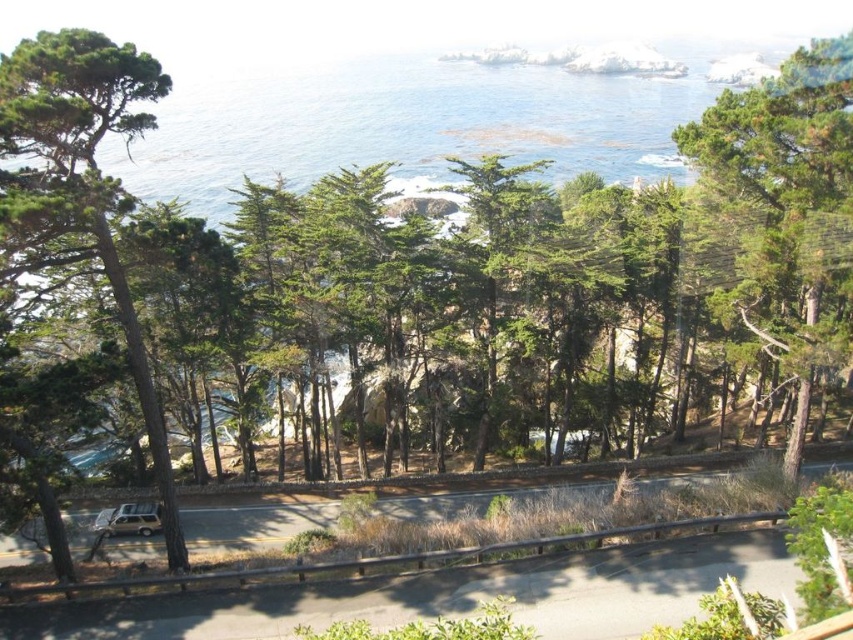
Who is more distant from viewer, (805,144) or (141,529)?

The point (141,529) is behind.

Is point (827, 321) positioned after point (140, 506)?

No, (827, 321) is closer to viewer.

What do you see at coordinates (788, 202) in the screenshot? I see `green matte tree at right` at bounding box center [788, 202].

Where is `green matte tree at right`? This screenshot has width=853, height=640. green matte tree at right is located at coordinates (788, 202).

What do you see at coordinates (91, 176) in the screenshot?
I see `green textured tree at left` at bounding box center [91, 176].

You are a GUI agent. You are given a task and a screenshot of the screen. Output one action in this format:
    pyautogui.click(x=<x>, y=<y>)
    Task: Click on the green textured tree at left
    
    Given the screenshot: What is the action you would take?
    pyautogui.click(x=91, y=176)

Is point (798, 236) farther from viewer compared to point (103, 104)?

Yes.

Can you confirm if green matte tree at right is positioned below green textured tree at left?

Actually, green matte tree at right is above green textured tree at left.

Where is `green matte tree at right`? The image size is (853, 640). green matte tree at right is located at coordinates (788, 202).

This screenshot has height=640, width=853. I want to click on green matte tree at right, so click(x=788, y=202).